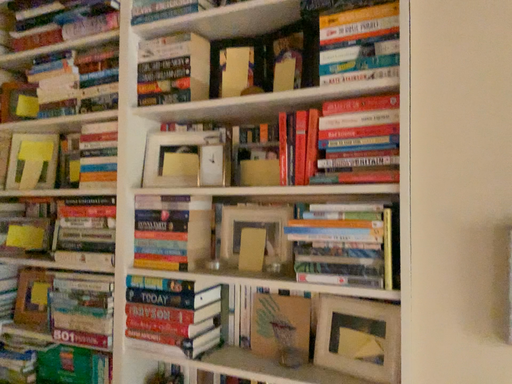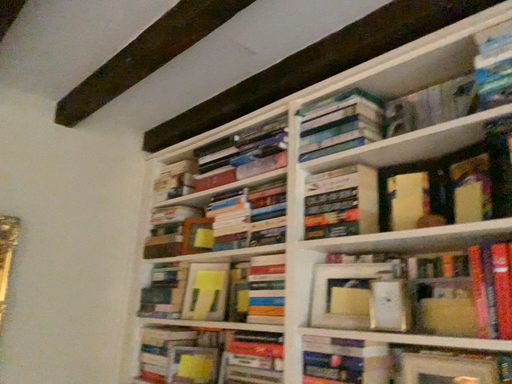
Question: How did the camera likely rotate when shooting the video?

Choices:
 (A) rotated downward
 (B) rotated upward

Answer: (B)